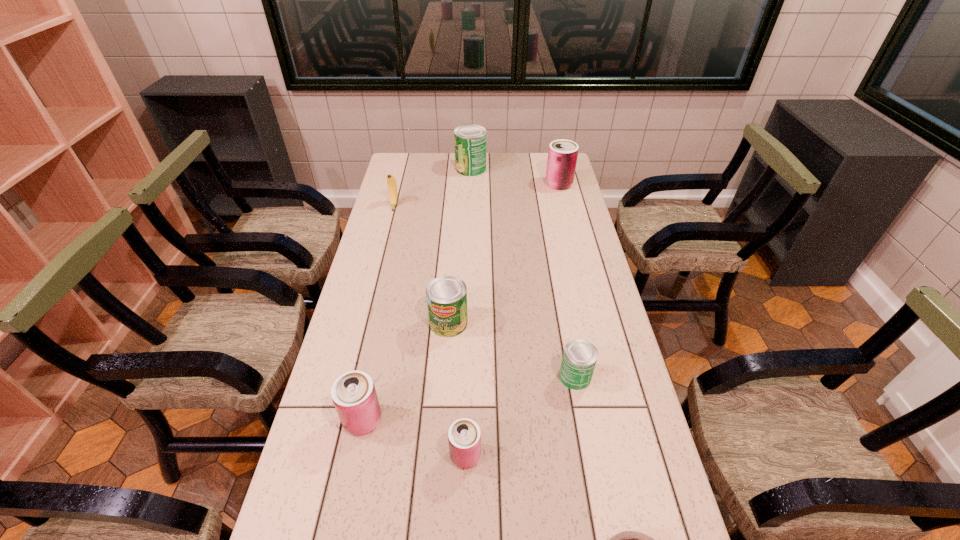
Point out which pink can is positioned as the third nearest to the sixth nearest object. Please provide its 2D coordinates. Your answer should be formatted as a tuple, i.e. [(x, y)], where the tuple contains the x and y coordinates of a point satisfying the conditions above.

[(464, 436)]

The width and height of the screenshot is (960, 540). What are the coordinates of `free space in the image that satisfies the following two spatial constraints: 1. from the stem of the banana; 2. on the right side of the fourth farthest object` in the screenshot? It's located at click(365, 323).

Where is `vacant point that satisfies the following two spatial constraints: 1. on the back side of the biggest pink can; 2. on the left side of the smallest pink can`? vacant point that satisfies the following two spatial constraints: 1. on the back side of the biggest pink can; 2. on the left side of the smallest pink can is located at coordinates (472, 184).